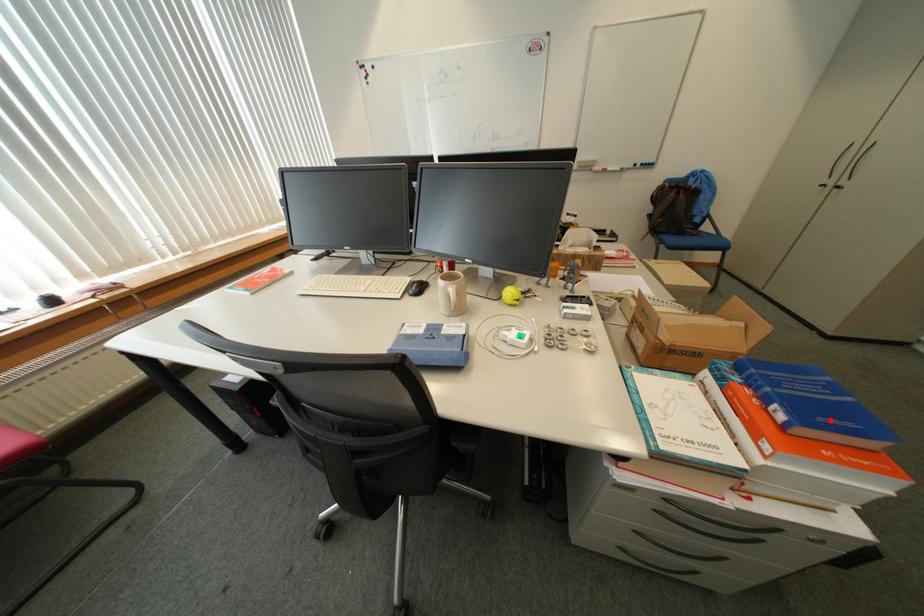
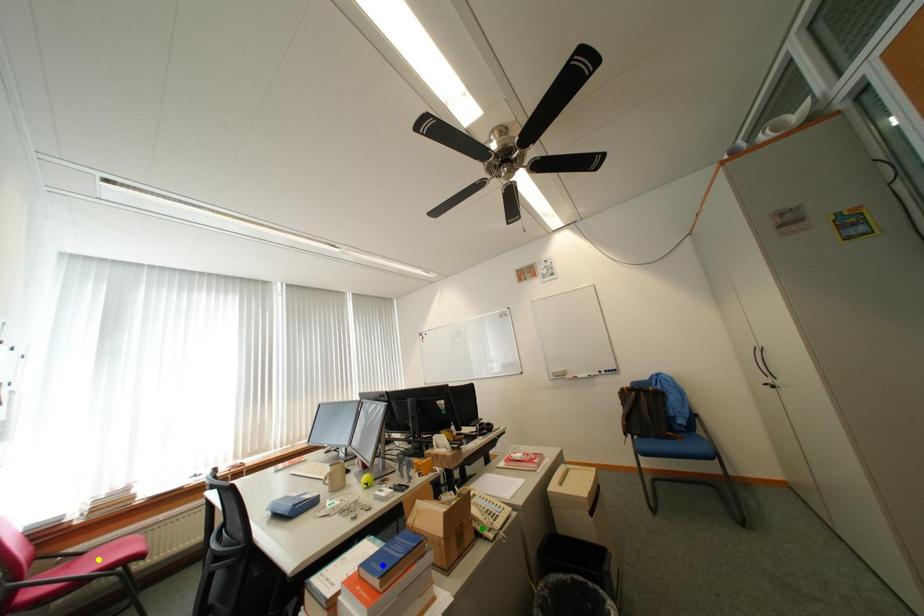
Question: I am providing you with two images of the same scene from different viewpoints. A red point is marked on the first image. You are given multiple points on the second image. In image 2, which mark is for the same physical point as the one in image 1?

Choices:
 (A) blue point
 (B) yellow point
 (C) green point

Answer: (A)